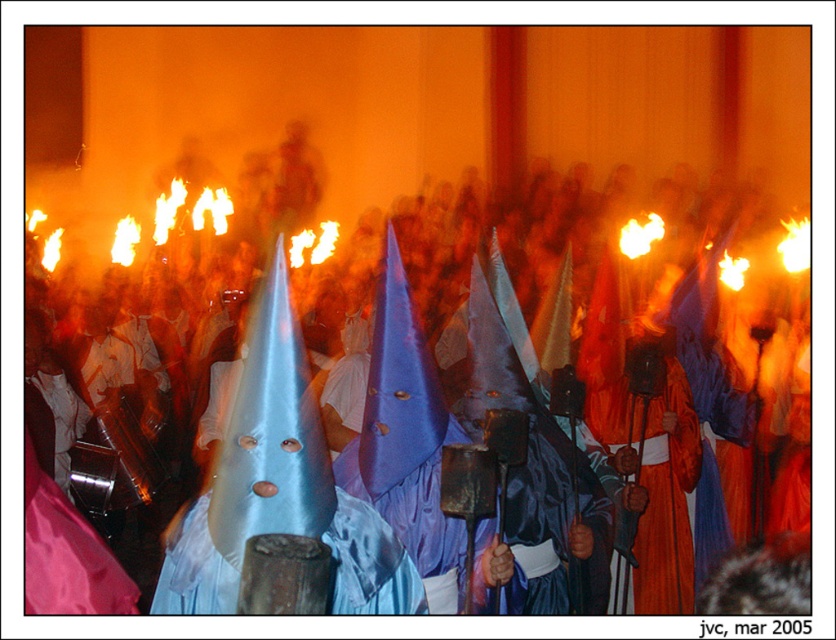
Who is positioned more to the left, satin blue cone at center or orange satin robe at center?

satin blue cone at center is more to the left.

Who is higher up, satin blue cone at center or orange satin robe at center?

orange satin robe at center is above.

At what (x,y) coordinates should I click in order to perform the action: click on satin blue cone at center. Please return your answer as a coordinate pair (x, y). Looking at the image, I should click on (546, 444).

Image resolution: width=836 pixels, height=640 pixels. I want to click on satin blue cone at center, so click(546, 444).